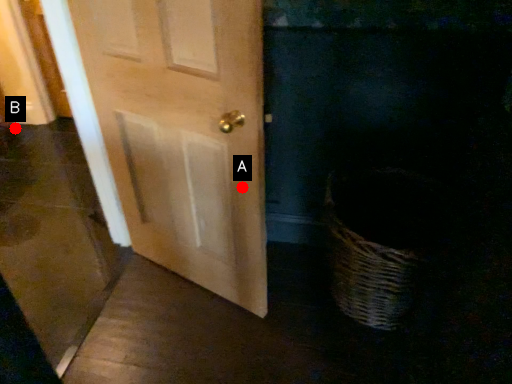
Question: Two points are circled on the image, labeled by A and B beside each circle. Which point is further to the camera?

Choices:
 (A) A is further
 (B) B is further

Answer: (B)